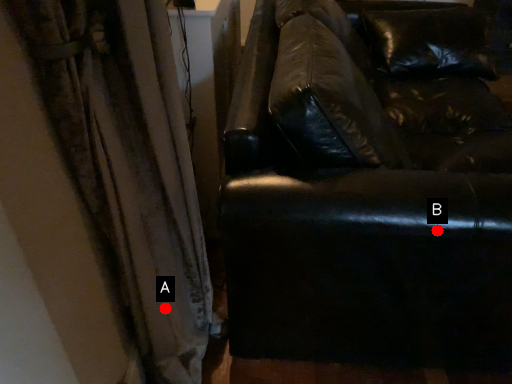
Question: Two points are circled on the image, labeled by A and B beside each circle. Which of the following is the closest to the observer?

Choices:
 (A) A is closer
 (B) B is closer

Answer: (B)